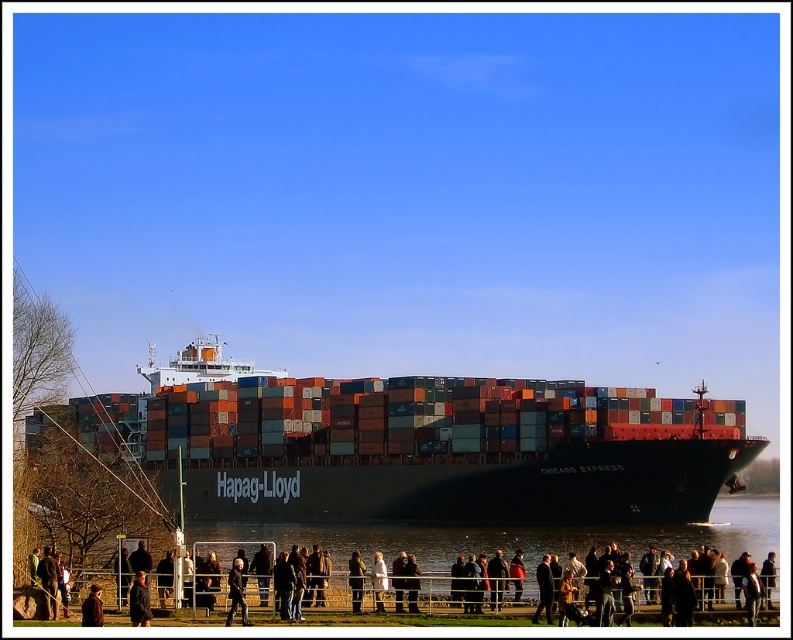
Does point (147, 417) lie in front of point (94, 588)?

No, it is not.

What do you see at coordinates (416, 445) in the screenshot? The height and width of the screenshot is (640, 793). I see `black matte container ship at center` at bounding box center [416, 445].

The height and width of the screenshot is (640, 793). I want to click on black matte container ship at center, so click(x=416, y=445).

Can you confirm if transparent water at lower center is positioned below dark gray jacket at center?

Yes, transparent water at lower center is below dark gray jacket at center.

How much distance is there between transparent water at lower center and dark gray jacket at center?

The distance of transparent water at lower center from dark gray jacket at center is 52.30 meters.

Between point (751, 502) and point (234, 563), which one is positioned behind?

Point (751, 502)

Identify the location of transparent water at lower center. The height and width of the screenshot is (640, 793). (518, 536).

Is point (305, 470) positioned before point (331, 570)?

No, (305, 470) is behind (331, 570).

Does black matte container ship at center have a smaller size compared to dark brown leather jacket at lower center?

No.

This screenshot has width=793, height=640. What do you see at coordinates (416, 445) in the screenshot?
I see `black matte container ship at center` at bounding box center [416, 445].

Find the location of a particular element. The image size is (793, 640). black matte container ship at center is located at coordinates (416, 445).